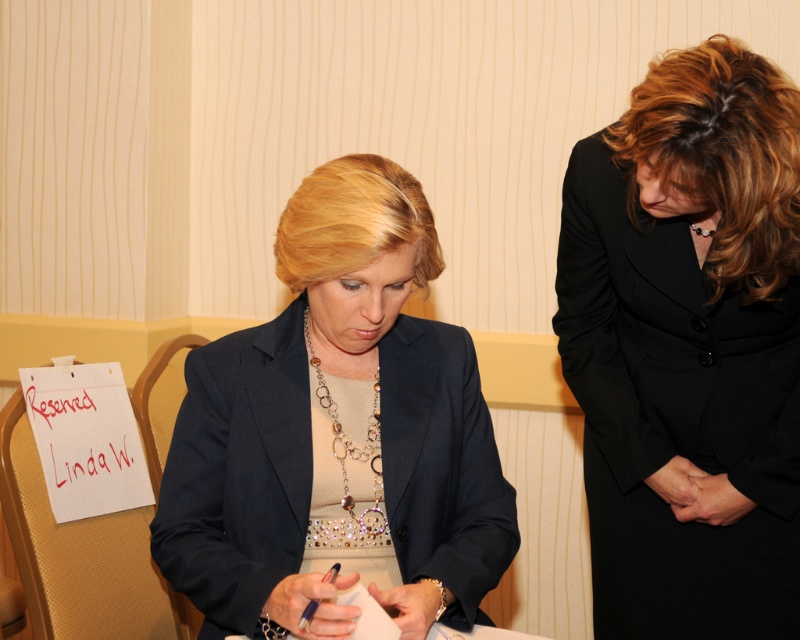
Who is more forward, (656, 580) or (132, 477)?

Positioned in front is point (656, 580).

Describe the element at coordinates (688, 348) in the screenshot. I see `black wool coat at center` at that location.

The height and width of the screenshot is (640, 800). Describe the element at coordinates (688, 348) in the screenshot. I see `black wool coat at center` at that location.

Where is `black wool coat at center`? This screenshot has height=640, width=800. black wool coat at center is located at coordinates (688, 348).

Is point (666, 214) farther from viewer compared to point (304, 456)?

Yes.

From the picture: Between black wool coat at center and matte black blazer at center, which one is positioned higher?

black wool coat at center is above.

Between point (686, 493) and point (218, 401), which one is positioned in front?

Point (218, 401) is more forward.

At what (x,y) coordinates should I click in order to perform the action: click on black wool coat at center. Please return your answer as a coordinate pair (x, y). Image resolution: width=800 pixels, height=640 pixels. Looking at the image, I should click on (688, 348).

Does point (252, 524) come in front of point (93, 456)?

That is True.

Is matte black blazer at center shorter than red handwritten text at center?

Incorrect, matte black blazer at center's height does not fall short of red handwritten text at center's.

What do you see at coordinates (322, 429) in the screenshot? I see `matte black blazer at center` at bounding box center [322, 429].

The image size is (800, 640). What are the coordinates of `matte black blazer at center` in the screenshot? It's located at (322, 429).